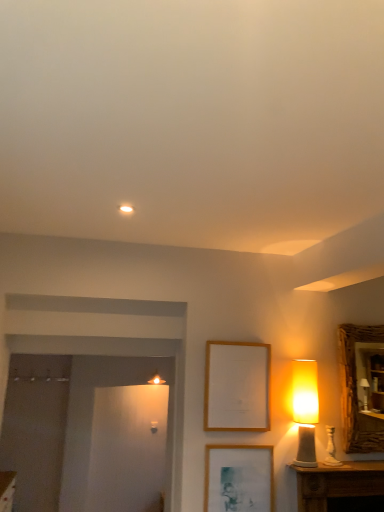
The image size is (384, 512). Identify the location of wooden textured mirror at right. (356, 391).

The image size is (384, 512). What do you see at coordinates (238, 478) in the screenshot? I see `wooden picture frame at lower center, arranged as the second picture frame when viewed from the top` at bounding box center [238, 478].

Describe the element at coordinates (305, 409) in the screenshot. The height and width of the screenshot is (512, 384). I see `matte yellow lampshade at right` at that location.

The height and width of the screenshot is (512, 384). In order to click on wooden textured mirror at right in this screenshot , I will do `click(356, 391)`.

Which is behind, point (215, 494) or point (359, 449)?

The point (359, 449) is behind.

Is wooden textured mirror at right at the back of wooden picture frame at lower center, arranged as the second picture frame when viewed from the top?

No, wooden textured mirror at right is not at the back of wooden picture frame at lower center, arranged as the second picture frame when viewed from the top.

Could you measure the distance between wooden picture frame at lower center, arranged as the second picture frame when viewed from the top, and wooden textured mirror at right?

They are 28.68 inches apart.

In terms of width, does wooden picture frame at lower center, arranged as the second picture frame when viewed from the top, look wider or thinner when compared to wooden textured mirror at right?

Clearly, wooden picture frame at lower center, arranged as the second picture frame when viewed from the top, has less width compared to wooden textured mirror at right.

Who is more distant, wooden textured mirror at right or wooden picture frame at center, which is counted as the 1th picture frame, starting from the top?

wooden textured mirror at right is behind.

From a real-world perspective, is wooden textured mirror at right under wooden picture frame at center, which appears as the second picture frame when ordered from the bottom?

No, from a real-world perspective, wooden textured mirror at right is not under wooden picture frame at center, which appears as the second picture frame when ordered from the bottom.

Looking at this image, which object is wider, wooden textured mirror at right or wooden picture frame at center, which is counted as the 1th picture frame, starting from the top?

wooden textured mirror at right is wider.

Based on their sizes in the image, would you say matte yellow lampshade at right is bigger or smaller than wooden textured mirror at right?

In the image, matte yellow lampshade at right appears to be smaller than wooden textured mirror at right.

Which object is positioned more to the left, matte yellow lampshade at right or wooden textured mirror at right?

matte yellow lampshade at right.

Is matte yellow lampshade at right facing away from wooden textured mirror at right?

No, matte yellow lampshade at right is not facing away from wooden textured mirror at right.

Is wooden picture frame at lower center, the 1th picture frame ordered from the bottom, located within matte yellow lampshade at right?

No.

From a real-world perspective, between matte yellow lampshade at right and wooden picture frame at lower center, arranged as the second picture frame when viewed from the top, who is vertically lower?

wooden picture frame at lower center, arranged as the second picture frame when viewed from the top.

Consider the image. Which object is positioned more to the left, matte yellow lampshade at right or wooden picture frame at lower center, arranged as the second picture frame when viewed from the top?

Positioned to the left is wooden picture frame at lower center, arranged as the second picture frame when viewed from the top.

Can you confirm if matte yellow lampshade at right is shorter than wooden picture frame at lower center, arranged as the second picture frame when viewed from the top?

No, matte yellow lampshade at right is not shorter than wooden picture frame at lower center, arranged as the second picture frame when viewed from the top.

Where is `mirror on the right of matte yellow lampshade at right`? The width and height of the screenshot is (384, 512). mirror on the right of matte yellow lampshade at right is located at coordinates (356, 391).

Considering the positions of objects wooden textured mirror at right and matte yellow lampshade at right in the image provided, who is in front, wooden textured mirror at right or matte yellow lampshade at right?

matte yellow lampshade at right is in front.

Which is further, [354,334] or [301,446]?

Point [354,334]

Considering the sizes of wooden textured mirror at right and matte yellow lampshade at right in the image, is wooden textured mirror at right taller or shorter than matte yellow lampshade at right?

wooden textured mirror at right is taller than matte yellow lampshade at right.

Could you measure the distance between matte yellow lampshade at right and wooden picture frame at center, which appears as the second picture frame when ordered from the bottom?

matte yellow lampshade at right is 33.06 centimeters from wooden picture frame at center, which appears as the second picture frame when ordered from the bottom.

Which object is more forward, matte yellow lampshade at right or wooden picture frame at center, which is counted as the 1th picture frame, starting from the top?

matte yellow lampshade at right is in front.

Could you tell me if matte yellow lampshade at right is facing wooden picture frame at center, which is counted as the 1th picture frame, starting from the top?

No, matte yellow lampshade at right is not oriented towards wooden picture frame at center, which is counted as the 1th picture frame, starting from the top.

Is matte yellow lampshade at right surrounding wooden picture frame at center, which is counted as the 1th picture frame, starting from the top?

No.

Consider the image. From the image's perspective, does wooden picture frame at lower center, arranged as the second picture frame when viewed from the top, appear lower than matte yellow lampshade at right?

Yes.

How many degrees apart are the facing directions of wooden picture frame at lower center, the 1th picture frame ordered from the bottom, and matte yellow lampshade at right?

They differ by 0.00155 degrees in their facing directions.

From a real-world perspective, which object rests below the other?

wooden picture frame at lower center, the 1th picture frame ordered from the bottom, is physically lower.

Is wooden picture frame at lower center, arranged as the second picture frame when viewed from the top, oriented away from matte yellow lampshade at right?

wooden picture frame at lower center, arranged as the second picture frame when viewed from the top, is not turned away from matte yellow lampshade at right.

At what (x,y) coordinates should I click in order to perform the action: click on picture frame below the wooden textured mirror at right (from the image's perspective). Please return your answer as a coordinate pair (x, y). Looking at the image, I should click on (238, 478).

Find the location of a particular element. the 1st picture frame counting from the left side of the wooden textured mirror at right is located at coordinates (237, 386).

Considering their positions, is matte yellow lampshade at right positioned closer to wooden picture frame at lower center, the 1th picture frame ordered from the bottom, than wooden picture frame at center, which is counted as the 1th picture frame, starting from the top?

wooden picture frame at center, which is counted as the 1th picture frame, starting from the top.

Estimate the real-world distances between objects in this image. Which object is further from wooden picture frame at center, which appears as the second picture frame when ordered from the bottom, matte yellow lampshade at right or wooden textured mirror at right?

The object further to wooden picture frame at center, which appears as the second picture frame when ordered from the bottom, is wooden textured mirror at right.

Based on their spatial positions, is wooden picture frame at lower center, the 1th picture frame ordered from the bottom, or wooden textured mirror at right closer to matte yellow lampshade at right?

Among the two, wooden textured mirror at right is located nearer to matte yellow lampshade at right.

Estimate the real-world distances between objects in this image. Which object is further from wooden textured mirror at right, wooden picture frame at lower center, arranged as the second picture frame when viewed from the top, or matte yellow lampshade at right?

wooden picture frame at lower center, arranged as the second picture frame when viewed from the top, is further to wooden textured mirror at right.

From the image, which object appears to be farther from matte yellow lampshade at right, wooden picture frame at center, which appears as the second picture frame when ordered from the bottom, or wooden textured mirror at right?

wooden picture frame at center, which appears as the second picture frame when ordered from the bottom, is further to matte yellow lampshade at right.

Looking at the image, which one is located closer to matte yellow lampshade at right, wooden textured mirror at right or wooden picture frame at lower center, the 1th picture frame ordered from the bottom?

Based on the image, wooden textured mirror at right appears to be nearer to matte yellow lampshade at right.

Estimate the real-world distances between objects in this image. Which object is further from matte yellow lampshade at right, wooden picture frame at lower center, arranged as the second picture frame when viewed from the top, or wooden picture frame at center, which appears as the second picture frame when ordered from the bottom?

Based on the image, wooden picture frame at lower center, arranged as the second picture frame when viewed from the top, appears to be further to matte yellow lampshade at right.

From the picture: Looking at the image, which one is located further to wooden picture frame at center, which is counted as the 1th picture frame, starting from the top, wooden picture frame at lower center, the 1th picture frame ordered from the bottom, or wooden textured mirror at right?

Among the two, wooden textured mirror at right is located further to wooden picture frame at center, which is counted as the 1th picture frame, starting from the top.

Find the location of a particular element. The height and width of the screenshot is (512, 384). table lamp between wooden picture frame at center, which is counted as the 1th picture frame, starting from the top, and wooden picture frame at lower center, the 1th picture frame ordered from the bottom, from top to bottom is located at coordinates (305, 409).

Identify the location of table lamp between wooden picture frame at lower center, arranged as the second picture frame when viewed from the top, and wooden textured mirror at right. The height and width of the screenshot is (512, 384). [305, 409].

Image resolution: width=384 pixels, height=512 pixels. In order to click on table lamp between wooden picture frame at center, which appears as the second picture frame when ordered from the bottom, and wooden textured mirror at right in this screenshot , I will do `click(305, 409)`.

Where is `picture frame between wooden picture frame at lower center, the 1th picture frame ordered from the bottom, and wooden textured mirror at right from left to right`? This screenshot has height=512, width=384. picture frame between wooden picture frame at lower center, the 1th picture frame ordered from the bottom, and wooden textured mirror at right from left to right is located at coordinates (237, 386).